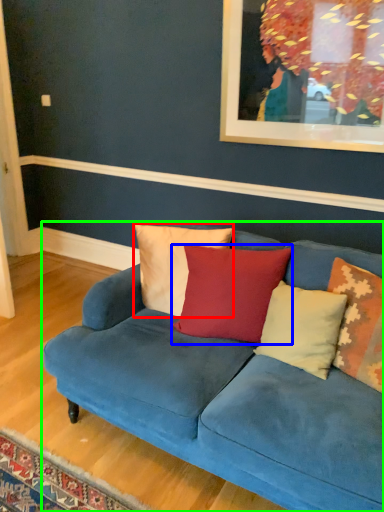
Question: Estimate the real-world distances between objects in this image. Which object is closer to pillow (highlighted by a red box), pillow (highlighted by a blue box) or studio couch (highlighted by a green box)?

Choices:
 (A) pillow
 (B) studio couch

Answer: (A)